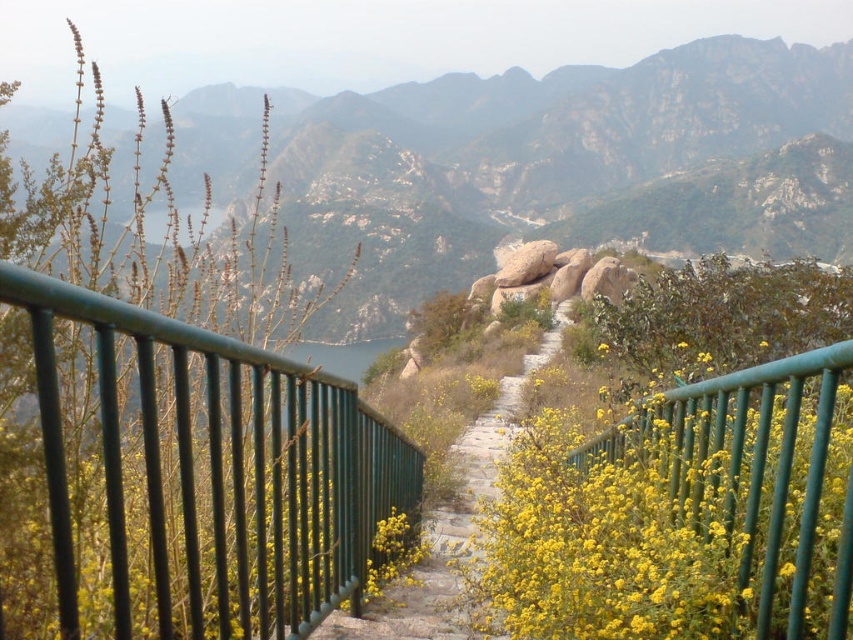
How much distance is there between rocky mountain at upper center and yellow matte flowers at center?

255.53 meters

Is rocky mountain at upper center thinner than yellow matte flowers at center?

No.

Identify the location of rocky mountain at upper center. This screenshot has width=853, height=640. (566, 168).

Where is `rocky mountain at upper center`? This screenshot has height=640, width=853. rocky mountain at upper center is located at coordinates (566, 168).

Does green metal railing at center appear under stone paved path at center?

No, green metal railing at center is not below stone paved path at center.

Is point (337, 456) positioned behind point (469, 456)?

No, (337, 456) is in front of (469, 456).

Find the location of `green metal railing at center`. green metal railing at center is located at coordinates (219, 474).

From the picture: Measure the distance between rocky mountain at upper center and stone paved path at center.

rocky mountain at upper center is 179.46 meters from stone paved path at center.

Looking at this image, is rocky mountain at upper center to the left of stone paved path at center from the viewer's perspective?

Yes, rocky mountain at upper center is to the left of stone paved path at center.

Who is more forward, [508,138] or [442,628]?

Point [442,628]

The height and width of the screenshot is (640, 853). I want to click on rocky mountain at upper center, so click(x=566, y=168).